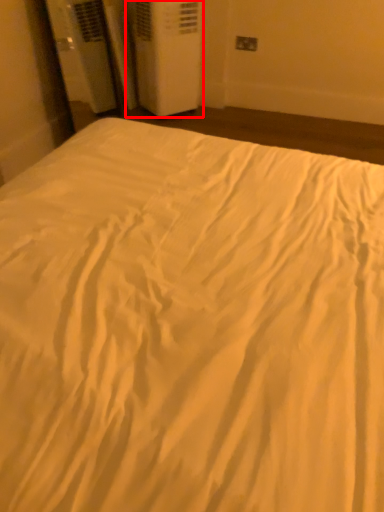
Question: From the image's perspective, where is air conditioning (annotated by the red box) located in relation to electric outlet in the image?

Choices:
 (A) above
 (B) below

Answer: (B)